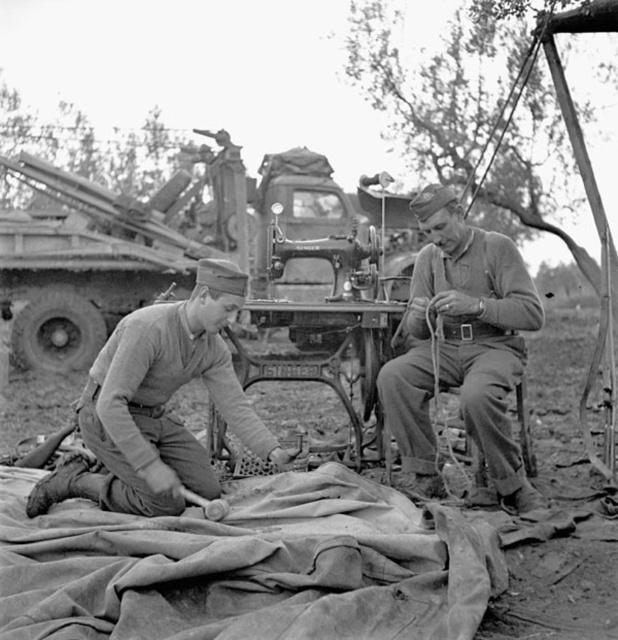
Question: Which object is farther from the camera taking this photo?

Choices:
 (A) camouflage fabric at lower left
 (B) matte khaki uniform at center
 (C) rough canvas blanket at lower center

Answer: (B)

Question: Does matte khaki uniform at center have a greater width compared to cast iron sewing machine at center?

Choices:
 (A) no
 (B) yes

Answer: (A)

Question: Is rough canvas blanket at lower center smaller than cast iron sewing machine at center?

Choices:
 (A) no
 (B) yes

Answer: (B)

Question: Is rough canvas blanket at lower center above cast iron sewing machine at center?

Choices:
 (A) no
 (B) yes

Answer: (A)

Question: Based on their relative distances, which object is farther from the matte khaki uniform at center?

Choices:
 (A) camouflage fabric at lower left
 (B) rough canvas blanket at lower center

Answer: (B)

Question: Which point is closer to the camera?

Choices:
 (A) (332, 259)
 (B) (163, 397)
 (C) (493, 248)

Answer: (B)